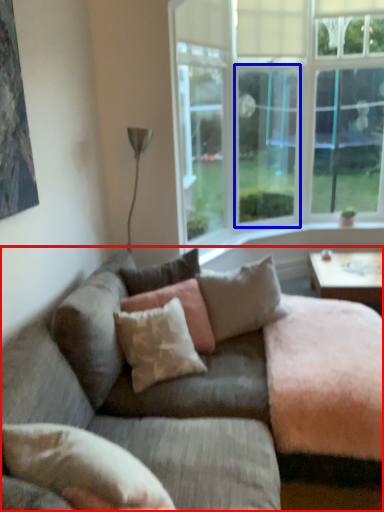
Question: Which object is closer to the camera taking this photo, studio couch (highlighted by a red box) or window screen (highlighted by a blue box)?

Choices:
 (A) studio couch
 (B) window screen

Answer: (A)